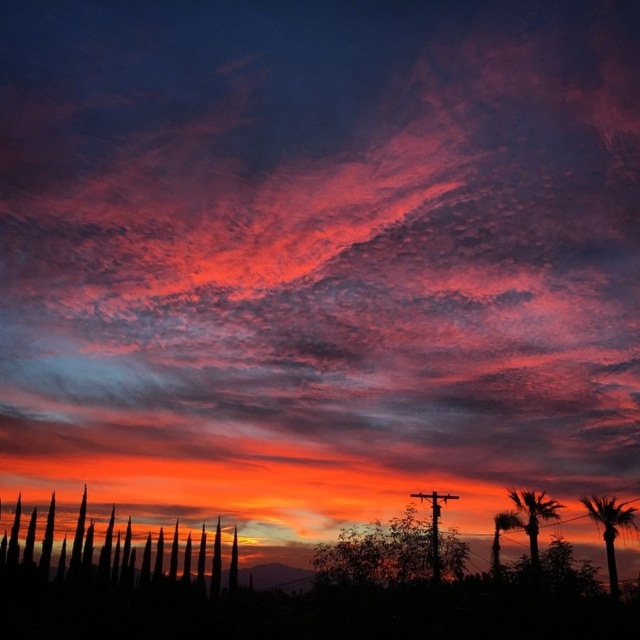
You are an artist trying to paint this sunset scene. You want to ensure the green leafy tree at center and the silky brown palm tree at right are proportionally accurate. Which tree should you paint as taller?

The silky brown palm tree at right should be painted taller since it is taller than the green leafy tree at center according to the description.

You are an artist painting this sunset scene. You want to ensure the green leafy tree at center and the silky brown palm tree at right are proportionally accurate. Which tree should you paint smaller to maintain the scene proportions?

The green leafy tree at center should be painted smaller than the silky brown palm tree at right to maintain the scene proportions since it occupies less space according to the description.

You are an artist trying to paint the sunset scene. You want to ensure the trees are proportionally accurate. Which of the two trees, the silky black trees at lower left or the silky brown palm tree at lower right, should you paint larger in your artwork?

The silky black trees at lower left should be painted larger than the silky brown palm tree at lower right since they are described as having a larger size compared to the palm tree.